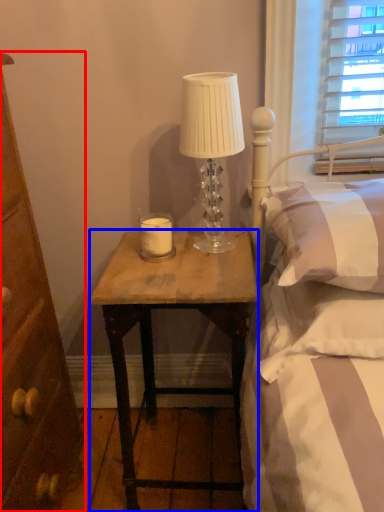
Question: Which object is closer to the camera taking this photo, cabinetry (highlighted by a red box) or desk (highlighted by a blue box)?

Choices:
 (A) cabinetry
 (B) desk

Answer: (A)